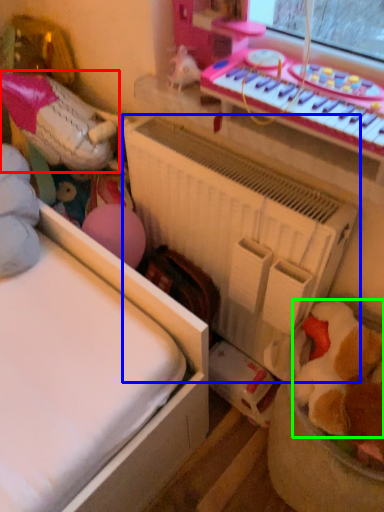
Question: Which object is the closest to the toy (highlighted by a red box)? Choose among these: radiator (highlighted by a blue box) or toy (highlighted by a green box).

Choices:
 (A) radiator
 (B) toy

Answer: (A)